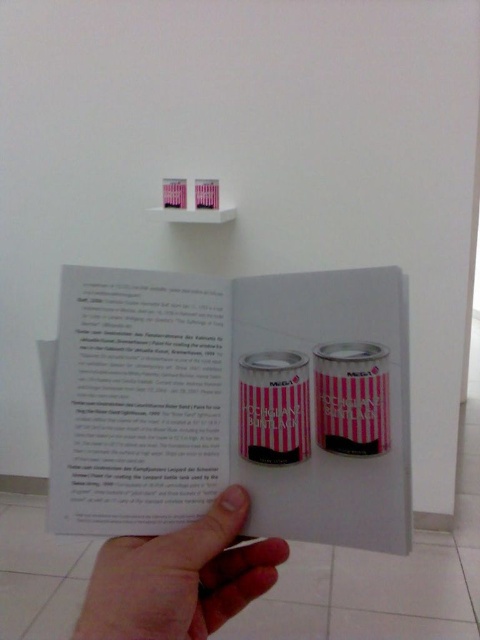
Between point (384, 348) and point (382, 428), which one is positioned in front?

Point (382, 428) is in front.

Is pink striped cans at center to the left of pink striped can at center from the viewer's perspective?

Indeed, pink striped cans at center is positioned on the left side of pink striped can at center.

At what (x,y) coordinates should I click in order to perform the action: click on pink striped cans at center. Please return your answer as a coordinate pair (x, y). The height and width of the screenshot is (640, 480). Looking at the image, I should click on (232, 403).

Locate an element on the screen. pink striped cans at center is located at coordinates (232, 403).

Can you confirm if pink striped cans at center is taller than flesh-toned skin at lower left?

Correct, pink striped cans at center is much taller as flesh-toned skin at lower left.

Does point (252, 406) come behind point (184, 577)?

Yes, it is behind point (184, 577).

The height and width of the screenshot is (640, 480). I want to click on pink striped cans at center, so click(232, 403).

Between flesh-toned skin at lower left and pink striped can at center, which one is positioned higher?

pink striped can at center is above.

Describe the element at coordinates (179, 577) in the screenshot. I see `flesh-toned skin at lower left` at that location.

Is point (212, 600) more distant than point (324, 374)?

No, (212, 600) is in front of (324, 374).

Where is `flesh-toned skin at lower left`? flesh-toned skin at lower left is located at coordinates (179, 577).